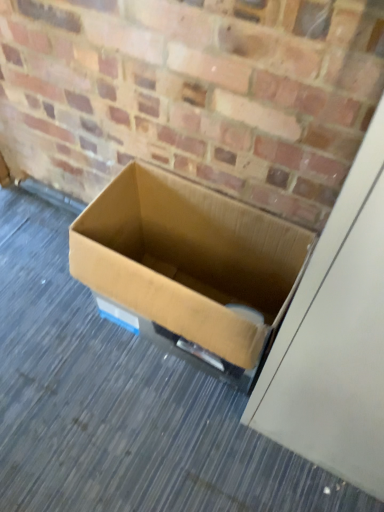
Find the location of `empty space that is ontop of brown cardboard box at center`. empty space that is ontop of brown cardboard box at center is located at coordinates (108, 375).